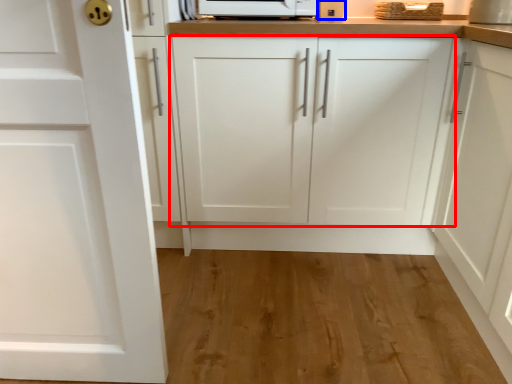
Question: Which of the following is the farthest to the observer, cabinetry (highlighted by a red box) or appliance (highlighted by a blue box)?

Choices:
 (A) cabinetry
 (B) appliance

Answer: (B)